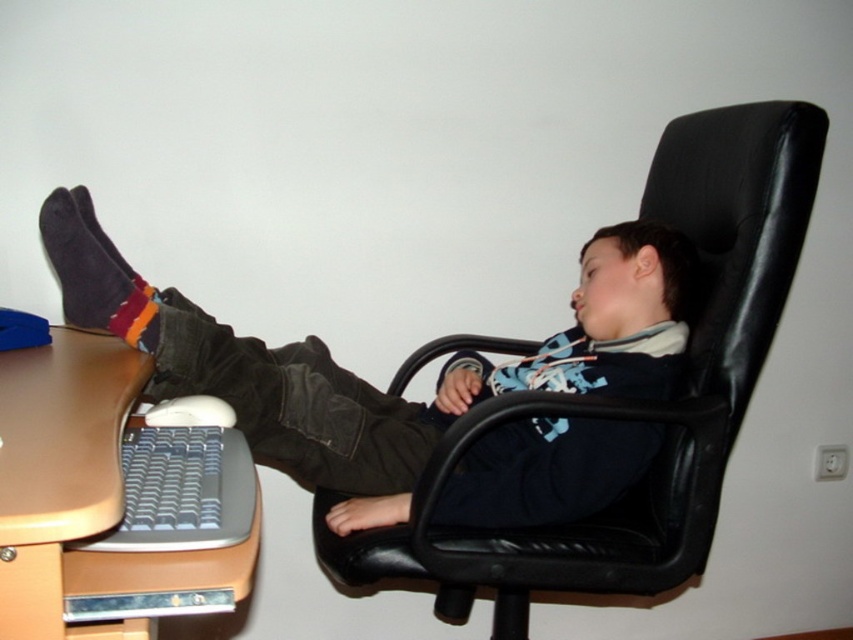
Question: Which of these objects is positioned closest to the dark blue sweater at center?

Choices:
 (A) black leather swivel chair at center
 (B) brown wood computer desk at lower left
 (C) dark gray suede socks at lower left

Answer: (A)

Question: Is dark blue sweater at center below brown wood computer desk at lower left?

Choices:
 (A) no
 (B) yes

Answer: (A)

Question: Does dark blue sweater at center appear on the left side of black leather swivel chair at center?

Choices:
 (A) yes
 (B) no

Answer: (A)

Question: Is dark blue sweater at center above dark gray suede socks at lower left?

Choices:
 (A) yes
 (B) no

Answer: (B)

Question: Among these objects, which one is nearest to the camera?

Choices:
 (A) dark blue sweater at center
 (B) black leather swivel chair at center

Answer: (A)

Question: Which object appears closest to the camera in this image?

Choices:
 (A) brown wood computer desk at lower left
 (B) black leather swivel chair at center
 (C) dark blue sweater at center
 (D) dark gray suede socks at lower left

Answer: (A)